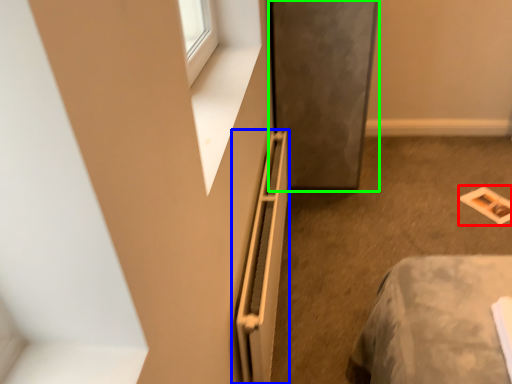
Question: Which object is positioned farthest from magazine (highlighted by a red box)? Select from radiator (highlighted by a blue box) and screen door (highlighted by a green box).

Choices:
 (A) radiator
 (B) screen door

Answer: (A)